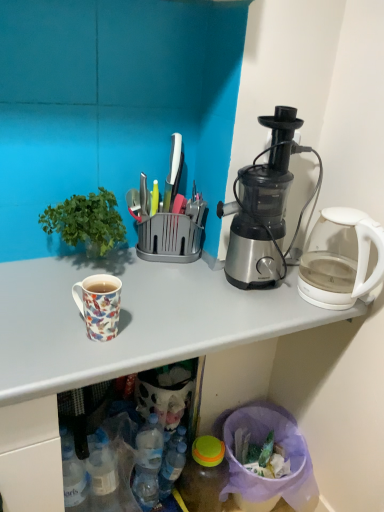
Find the location of a particular element. This screenshot has width=384, height=512. vacant region to the left of satin silver blender at right is located at coordinates (182, 283).